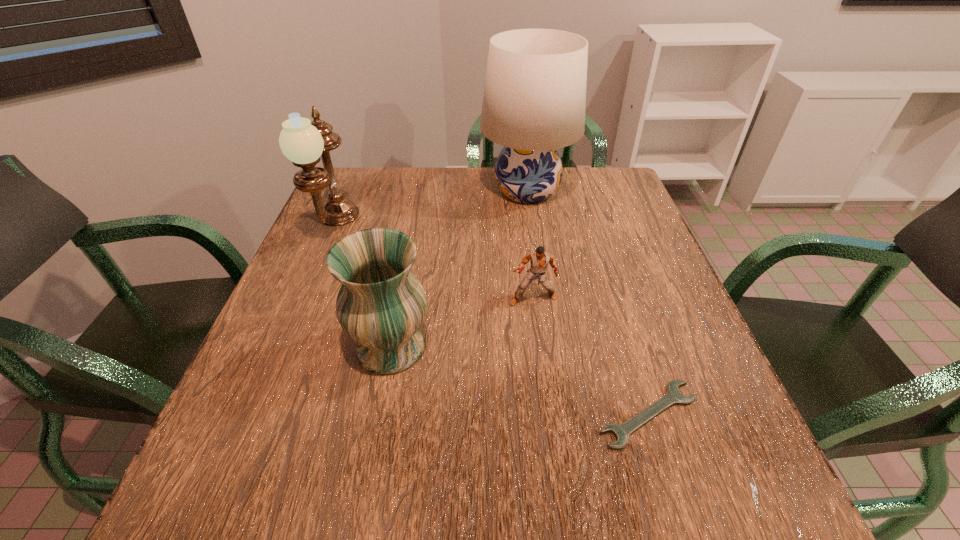
Where is `lampshade`? lampshade is located at coordinates (534, 101).

Find the location of `oil lamp`. oil lamp is located at coordinates 303,142.

Find the location of a particular element. The height and width of the screenshot is (540, 960). the leftmost object is located at coordinates (303, 142).

Locate an element on the screen. Image resolution: width=960 pixels, height=540 pixels. the third tallest object is located at coordinates (381, 304).

The width and height of the screenshot is (960, 540). I want to click on vase, so tap(381, 304).

The image size is (960, 540). I want to click on the third farthest object, so click(539, 260).

Find the location of a particular element. puncher is located at coordinates (539, 260).

This screenshot has height=540, width=960. Find the location of `the shortest object`. the shortest object is located at coordinates (673, 396).

This screenshot has width=960, height=540. I want to click on the nearest object, so click(x=673, y=396).

I want to click on vacant space positioned on the front-facing side of the tallest object, so click(381, 191).